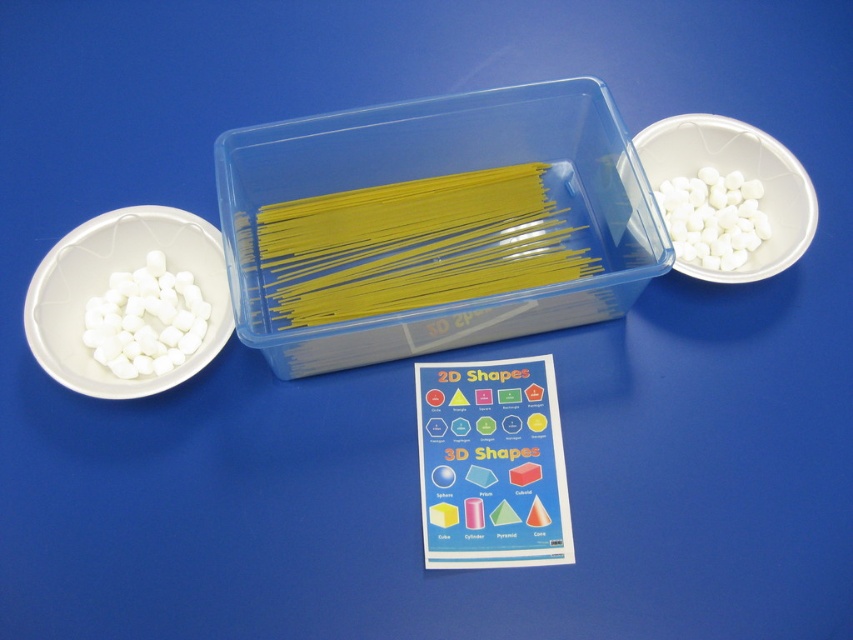
You are observing an educational setup where two points are marked on the blue surface. The first point is at coordinates point(276, 326) and the second is at point(691, 273). From your viewpoint, which point appears closer to you?

Point(691, 273) appears closer because it is in front of point(276, 326) according to their spatial arrangement.

You are a student trying to reach for the white matte bowl at left while holding the transparent plastic container at center. Which object will you need to move first to access the bowl?

The transparent plastic container at center is closer to the viewer than the white matte bowl at left, so you need to move the transparent plastic container at center first to access the white matte bowl at left.